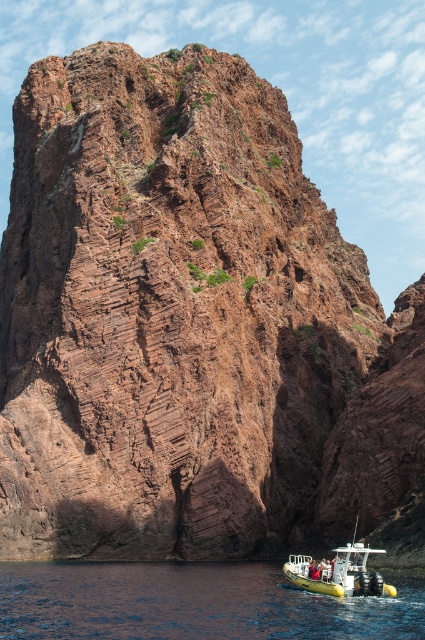
How much distance is there between blue rubber boat at lower right and yellow rubber boat at lower center?

blue rubber boat at lower right is 7.12 meters away from yellow rubber boat at lower center.

Image resolution: width=425 pixels, height=640 pixels. Identify the location of blue rubber boat at lower right. (192, 604).